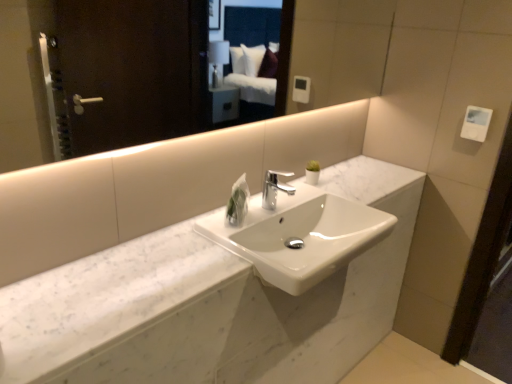
Question: From a real-world perspective, is white marble sink at center located beneath polished chrome faucet at center?

Choices:
 (A) no
 (B) yes

Answer: (B)

Question: From a real-world perspective, is white marble sink at center positioned over polished chrome faucet at center based on gravity?

Choices:
 (A) no
 (B) yes

Answer: (A)

Question: From the image's perspective, is white marble sink at center beneath polished chrome faucet at center?

Choices:
 (A) no
 (B) yes

Answer: (B)

Question: Considering the relative positions of white marble sink at center and polished chrome faucet at center in the image provided, is white marble sink at center in front of polished chrome faucet at center?

Choices:
 (A) no
 (B) yes

Answer: (B)

Question: Is white marble sink at center facing towards polished chrome faucet at center?

Choices:
 (A) yes
 (B) no

Answer: (B)

Question: In terms of width, does white marble sink at center look wider or thinner when compared to white glossy mirror at upper center?

Choices:
 (A) thin
 (B) wide

Answer: (B)

Question: Relative to white glossy mirror at upper center, is white marble sink at center in front or behind?

Choices:
 (A) front
 (B) behind

Answer: (B)

Question: From the image's perspective, is white marble sink at center above or below white glossy mirror at upper center?

Choices:
 (A) below
 (B) above

Answer: (A)

Question: Which is correct: white marble sink at center is inside white glossy mirror at upper center, or outside of it?

Choices:
 (A) inside
 (B) outside

Answer: (B)

Question: In terms of size, does polished chrome faucet at center appear bigger or smaller than white marble counter at center?

Choices:
 (A) small
 (B) big

Answer: (A)

Question: Which is correct: polished chrome faucet at center is inside white marble counter at center, or outside of it?

Choices:
 (A) outside
 (B) inside

Answer: (A)

Question: From the image's perspective, relative to white marble counter at center, is polished chrome faucet at center above or below?

Choices:
 (A) below
 (B) above

Answer: (B)

Question: Considering the positions of point (269, 206) and point (413, 188), is point (269, 206) closer or farther from the camera than point (413, 188)?

Choices:
 (A) farther
 (B) closer

Answer: (B)

Question: From a real-world perspective, relative to polished chrome faucet at center, is white glossy mirror at upper center vertically above or below?

Choices:
 (A) above
 (B) below

Answer: (A)

Question: Considering their positions, is white glossy mirror at upper center located in front of or behind polished chrome faucet at center?

Choices:
 (A) behind
 (B) front

Answer: (B)